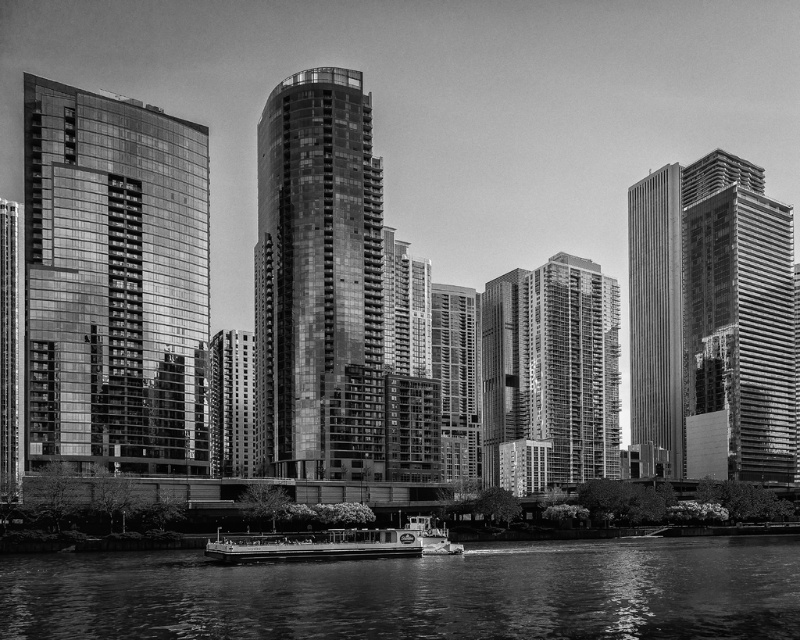
Question: Can you confirm if smooth glass building at center is wider than smooth gray skyscraper at right?

Choices:
 (A) yes
 (B) no

Answer: (A)

Question: Among these objects, which one is farthest from the camera?

Choices:
 (A) smooth gray skyscraper at right
 (B) smooth glass building at center

Answer: (A)

Question: Among these objects, which one is farthest from the camera?

Choices:
 (A) glassy reflective building at left
 (B) glossy glass building at center
 (C) reflective glass skyscraper at right

Answer: (C)

Question: Is glassy reflective building at left wider than smooth glass building at center?

Choices:
 (A) no
 (B) yes

Answer: (A)

Question: Does glassy reflective building at left appear on the left side of smooth gray skyscraper at right?

Choices:
 (A) yes
 (B) no

Answer: (A)

Question: Which object is the farthest from the smooth gray skyscraper at right?

Choices:
 (A) metallic polished boat at center
 (B) reflective glass skyscraper at right

Answer: (A)